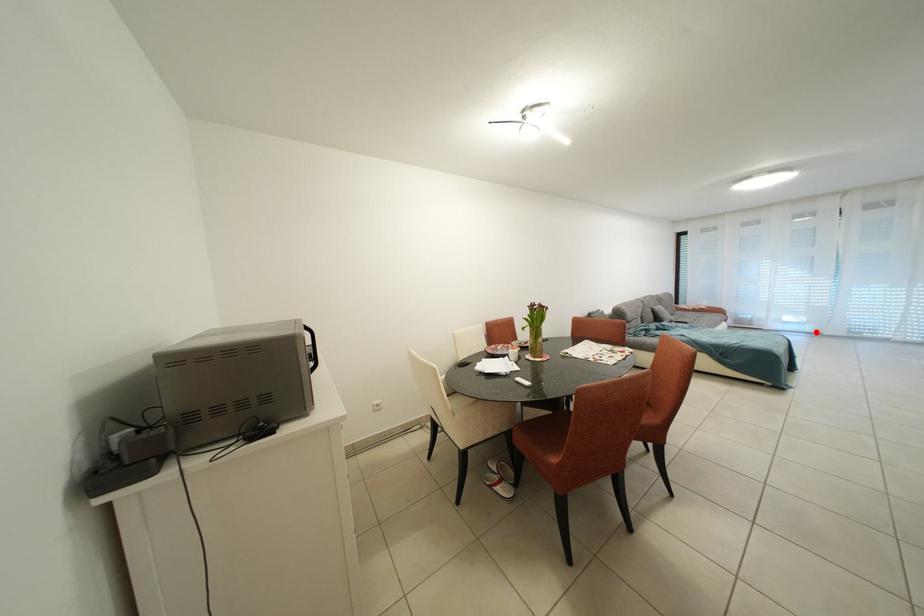
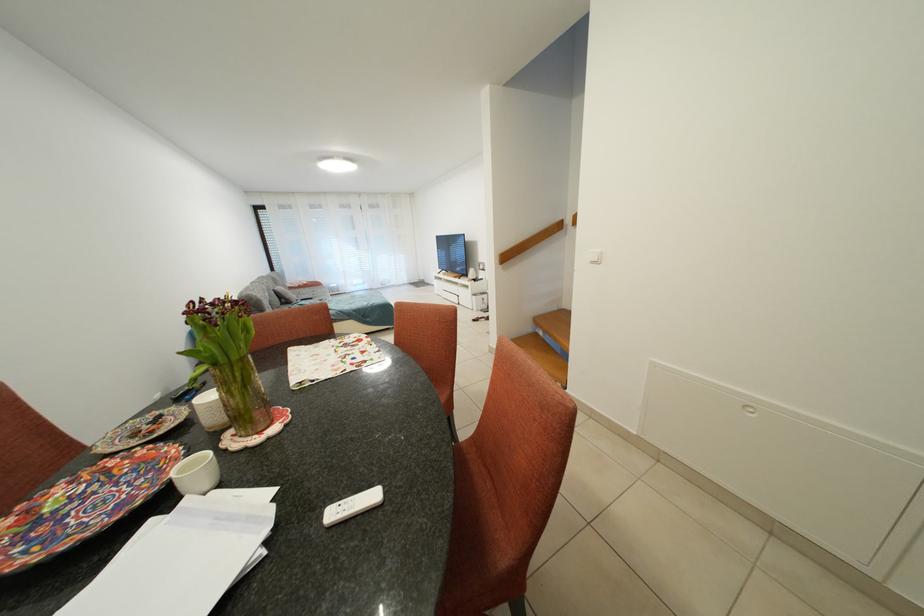
Question: I am providing you with two images of the same scene from different viewpoints. A red point is shown in image1. For the corresponding object point in image2, is it positioned nearer or farther from the camera?

Choices:
 (A) Nearer
 (B) Farther

Answer: (A)